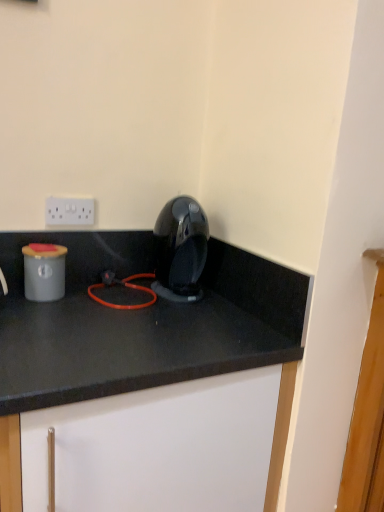
Question: Is white plastic electric outlet at upper center closer to the viewer compared to glossy plastic coffee machine at center?

Choices:
 (A) no
 (B) yes

Answer: (A)

Question: Could you tell me if white plastic electric outlet at upper center is facing glossy plastic coffee machine at center?

Choices:
 (A) no
 (B) yes

Answer: (A)

Question: Is glossy plastic coffee machine at center inside white plastic electric outlet at upper center?

Choices:
 (A) no
 (B) yes

Answer: (A)

Question: Does white plastic electric outlet at upper center have a smaller size compared to glossy plastic coffee machine at center?

Choices:
 (A) no
 (B) yes

Answer: (B)

Question: Is white plastic electric outlet at upper center oriented away from glossy plastic coffee machine at center?

Choices:
 (A) no
 (B) yes

Answer: (A)

Question: Does point (278, 335) appear closer or farther from the camera than point (157, 258)?

Choices:
 (A) closer
 (B) farther

Answer: (A)

Question: Is white matte cabinet at center in front of or behind glossy plastic coffee machine at center in the image?

Choices:
 (A) front
 (B) behind

Answer: (A)

Question: In the image, is white matte cabinet at center on the left side or the right side of glossy plastic coffee machine at center?

Choices:
 (A) right
 (B) left

Answer: (B)

Question: Looking at the image, does white matte cabinet at center seem bigger or smaller compared to glossy plastic coffee machine at center?

Choices:
 (A) big
 (B) small

Answer: (A)

Question: Relative to white matte cabinet at center, is glossy plastic coffee machine at center in front or behind?

Choices:
 (A) front
 (B) behind

Answer: (B)

Question: Is glossy plastic coffee machine at center bigger or smaller than white matte cabinet at center?

Choices:
 (A) big
 (B) small

Answer: (B)

Question: From a real-world perspective, is glossy plastic coffee machine at center positioned above or below white matte cabinet at center?

Choices:
 (A) above
 (B) below

Answer: (A)

Question: Considering the positions of glossy plastic coffee machine at center and white matte cabinet at center in the image, is glossy plastic coffee machine at center taller or shorter than white matte cabinet at center?

Choices:
 (A) short
 (B) tall

Answer: (A)

Question: From a real-world perspective, is white plastic electric outlet at upper center above or below glossy plastic coffee machine at center?

Choices:
 (A) above
 (B) below

Answer: (A)

Question: Would you say white plastic electric outlet at upper center is inside or outside glossy plastic coffee machine at center?

Choices:
 (A) inside
 (B) outside

Answer: (B)